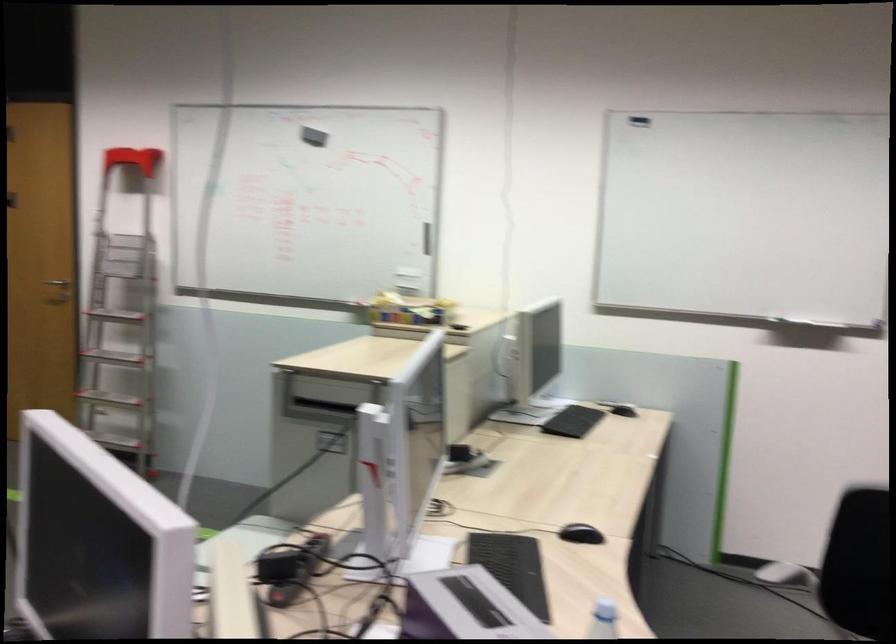
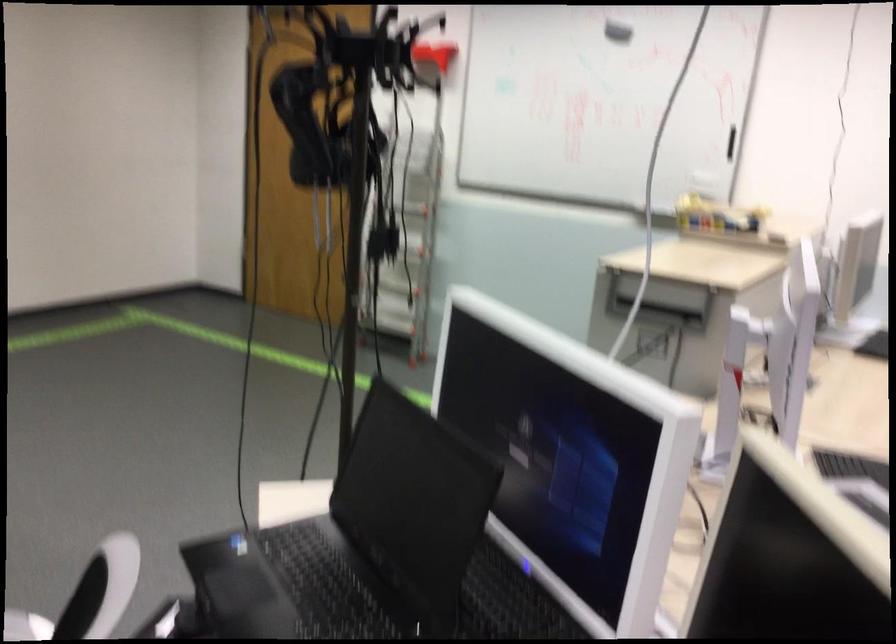
Find the pixel in the second image that matches [314,143] in the first image.

(617, 32)